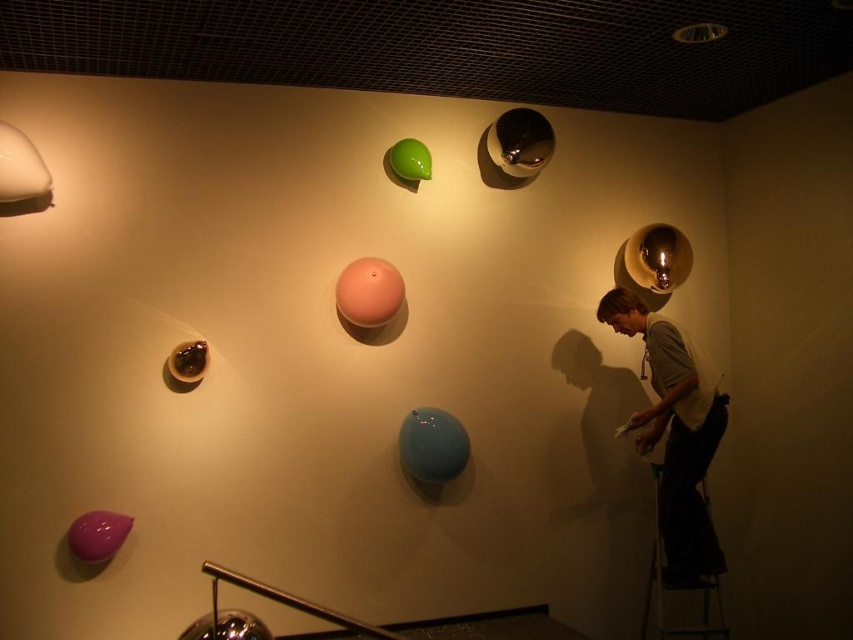
Looking at this image, does white cotton shirt at right come in front of purple glossy balloon at lower left?

No, it is behind purple glossy balloon at lower left.

What are the coordinates of `white cotton shirt at right` in the screenshot? It's located at (674, 435).

Identify the location of white cotton shirt at right. coord(674,435).

Which of these two, gold metallic bulb at upper right or glossy metallic lamp at upper center, stands shorter?

glossy metallic lamp at upper center is shorter.

Does gold metallic bulb at upper right have a smaller size compared to glossy metallic lamp at upper center?

Yes, gold metallic bulb at upper right is smaller than glossy metallic lamp at upper center.

You are a GUI agent. You are given a task and a screenshot of the screen. Output one action in this format:
    pyautogui.click(x=<x>, y=<y>)
    Task: Click on the gold metallic bulb at upper right
    The width and height of the screenshot is (853, 640).
    Given the screenshot: What is the action you would take?
    pyautogui.click(x=657, y=257)

Is white cotton shirt at right thinner than matte blue balloon at center?

Incorrect, white cotton shirt at right's width is not less than matte blue balloon at center's.

Does white cotton shirt at right appear on the left side of matte blue balloon at center?

Incorrect, white cotton shirt at right is not on the left side of matte blue balloon at center.

Find the location of `white cotton shirt at right`. white cotton shirt at right is located at coordinates (674, 435).